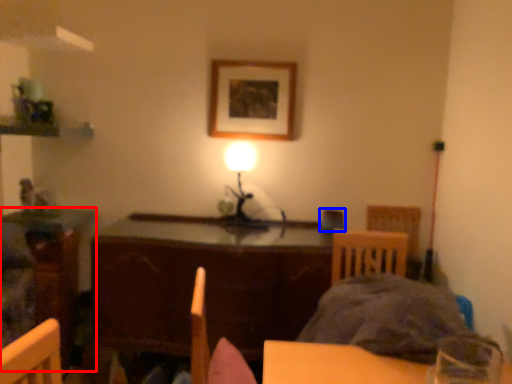
Question: Which object is further to the camera taking this photo, table (highlighted by a red box) or armchair (highlighted by a blue box)?

Choices:
 (A) table
 (B) armchair

Answer: (A)